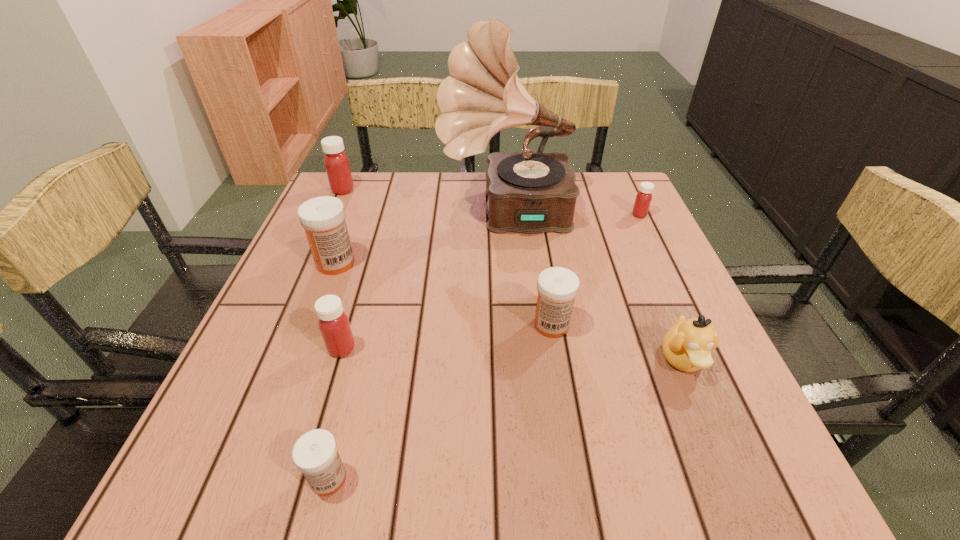
Find the location of a particular element. tan duckling is located at coordinates (687, 345).

Identify the location of the rightmost red medicine. (643, 199).

The image size is (960, 540). Identify the location of the smallest red medicine. (643, 199).

This screenshot has width=960, height=540. Find the location of `the smallest white medicine`. the smallest white medicine is located at coordinates (315, 454).

Where is `the nearest medicine`? the nearest medicine is located at coordinates (315, 454).

You are a GUI agent. You are given a task and a screenshot of the screen. Output one action in this format:
    pyautogui.click(x=<x>, y=<y>)
    Task: Click on the free spot located 0.130m from the horn of the record player
    This screenshot has height=540, width=960.
    Given the screenshot: What is the action you would take?
    pyautogui.click(x=391, y=214)

Locate an element on the screen. vacant region located 0.190m from the horn of the record player is located at coordinates (369, 214).

You are a GUI agent. You are given a task and a screenshot of the screen. Output one action in this format:
    pyautogui.click(x=<x>, y=<y>)
    Task: Click on the vacant space located from the horn of the record player
    
    Given the screenshot: What is the action you would take?
    pyautogui.click(x=319, y=214)

I want to click on free space located on the right of the farthest medicine, so click(453, 190).

The width and height of the screenshot is (960, 540). I want to click on free region located 0.090m on the front of the fourth nearest medicine, so click(320, 306).